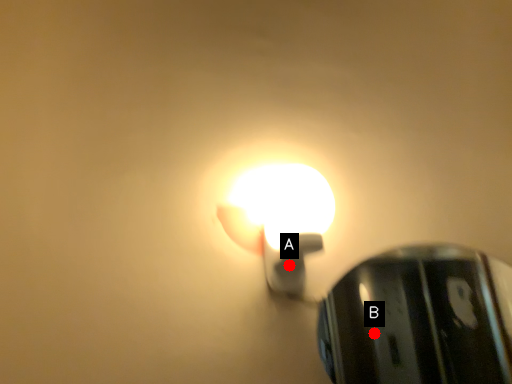
Question: Two points are circled on the image, labeled by A and B beside each circle. Which point appears closest to the camera in this image?

Choices:
 (A) A is closer
 (B) B is closer

Answer: (A)